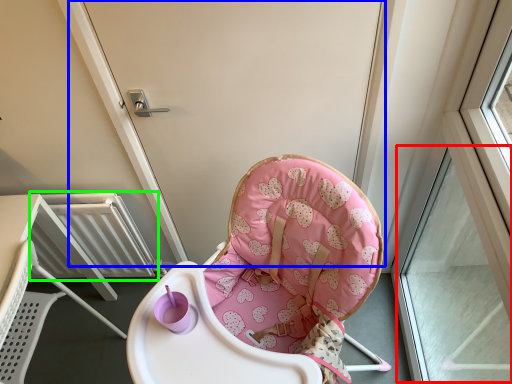
Question: Which is farther away from window (highlighted by a red box)? screen door (highlighted by a blue box) or radiator (highlighted by a green box)?

Choices:
 (A) screen door
 (B) radiator

Answer: (B)